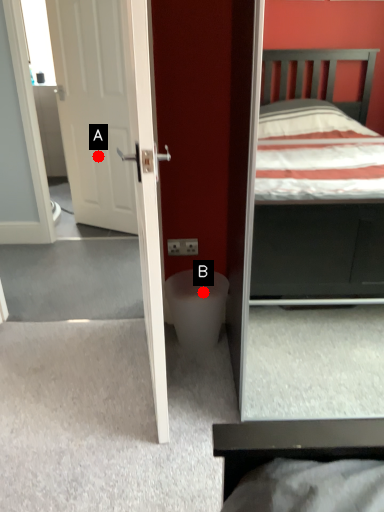
Question: Two points are circled on the image, labeled by A and B beside each circle. Which point is further to the camera?

Choices:
 (A) A is further
 (B) B is further

Answer: (A)